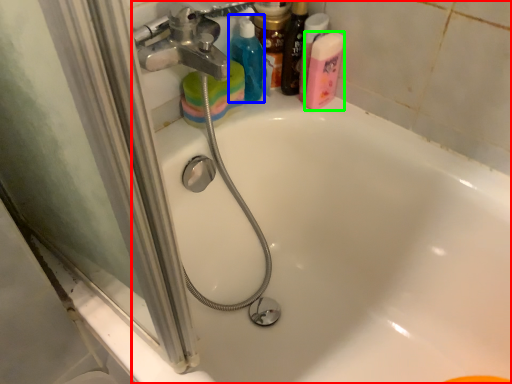
Question: Considering the real-world distances, which object is closest to bathtub (highlighted by a red box)? cleaning product (highlighted by a blue box) or cleaning product (highlighted by a green box).

Choices:
 (A) cleaning product
 (B) cleaning product

Answer: (B)